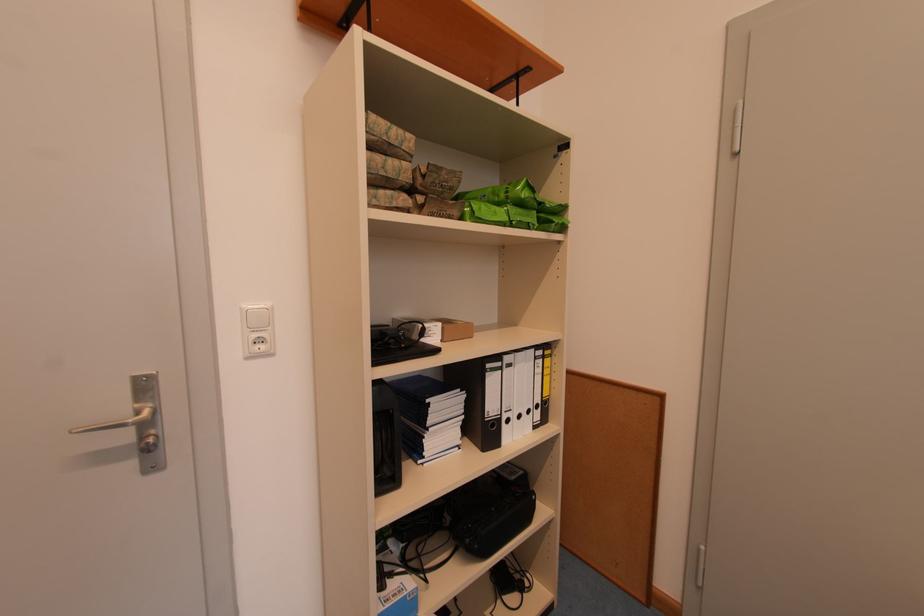
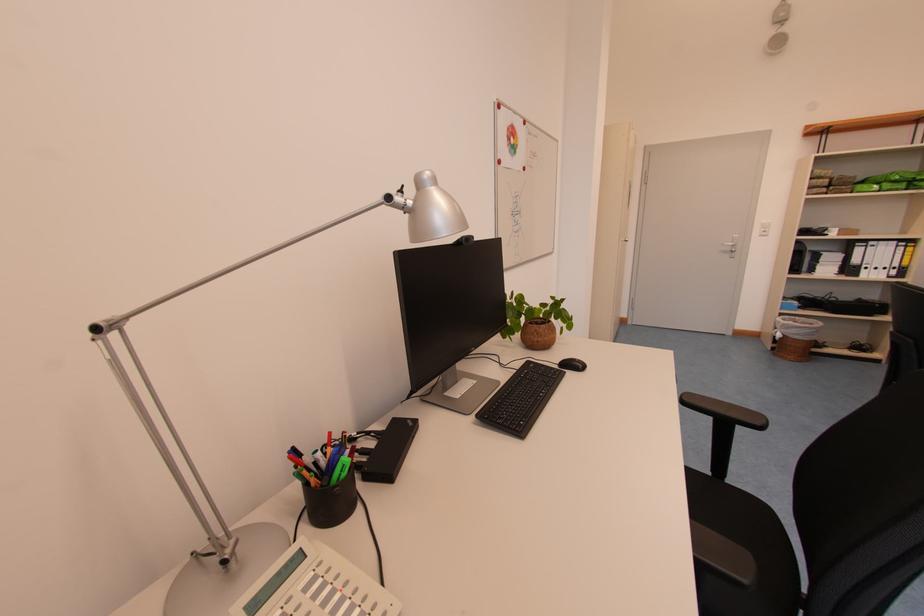
Locate, in the second image, the point that corresponds to the point at 131,440 in the first image.

(736, 252)